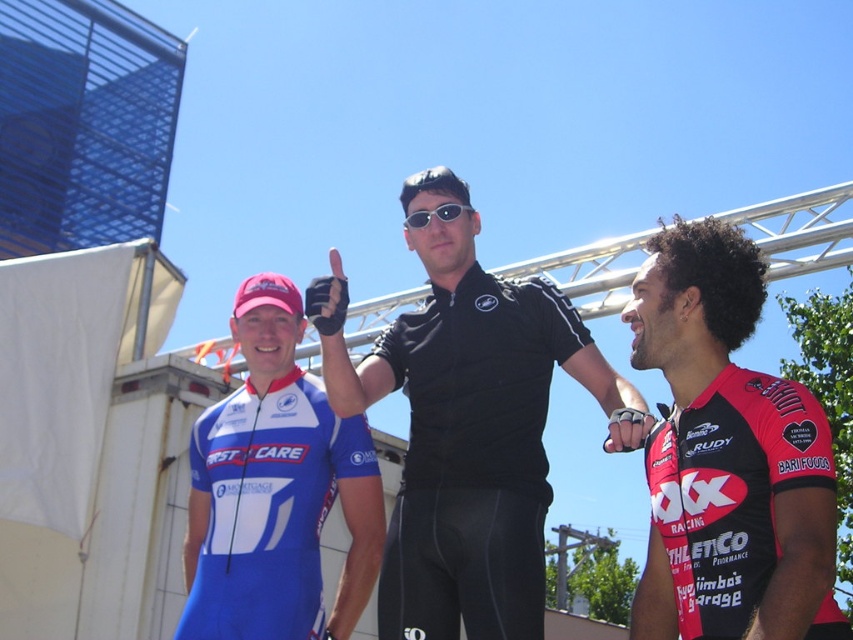
Question: Is red matte jersey at right wider than sunglasses at center?

Choices:
 (A) no
 (B) yes

Answer: (B)

Question: Which point is closer to the camera?

Choices:
 (A) black matte shirt at center
 (B) red matte jersey at right
 (C) sunglasses at center

Answer: (B)

Question: Which is nearer to the black matte shirt at center?

Choices:
 (A) red matte jersey at right
 (B) sunglasses at center
 (C) blue jersey at center

Answer: (C)

Question: Does red matte jersey at right have a greater width compared to blue jersey at center?

Choices:
 (A) yes
 (B) no

Answer: (B)

Question: Which point is closer to the camera?

Choices:
 (A) blue jersey at center
 (B) black matte shirt at center

Answer: (B)

Question: Considering the relative positions of black matte shirt at center and sunglasses at center in the image provided, where is black matte shirt at center located with respect to sunglasses at center?

Choices:
 (A) above
 (B) below

Answer: (B)